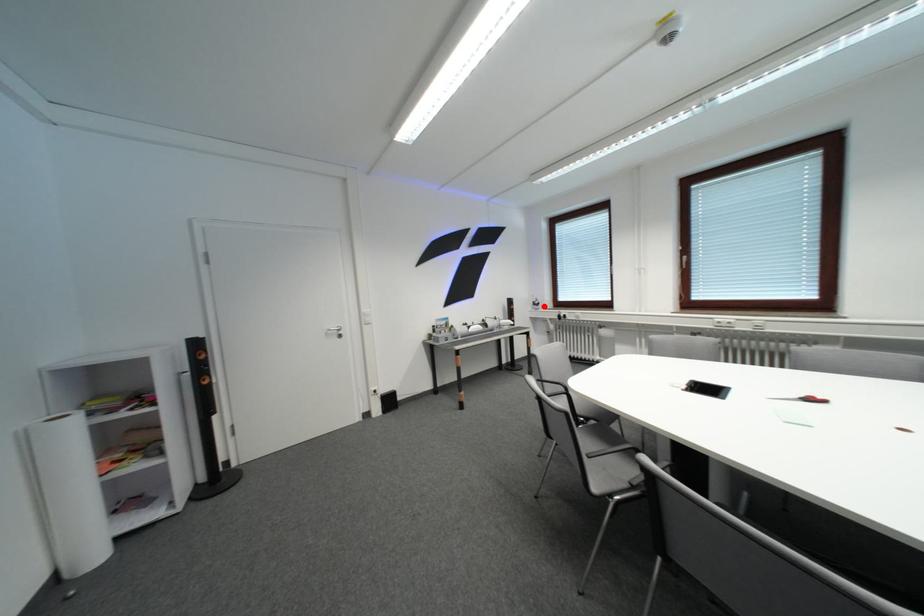
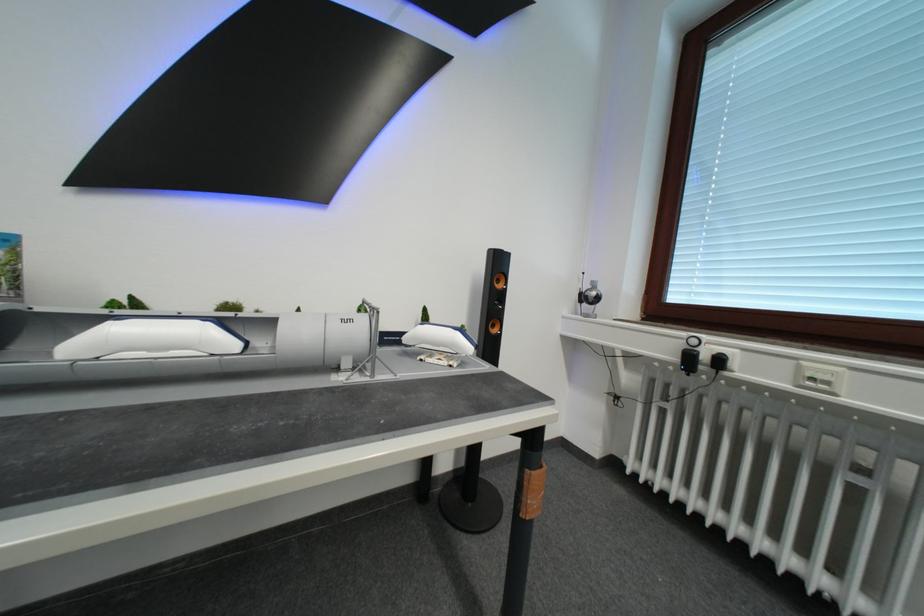
Find the pixel in the second image that matches the highlighted location in the first image.

(592, 301)